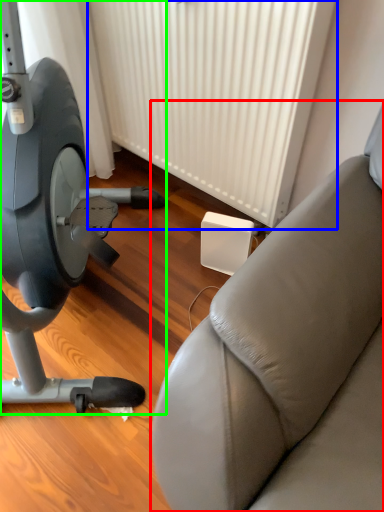
Question: Estimate the real-world distances between objects in this image. Which object is closer to studio couch (highlighted by a red box), radiator (highlighted by a blue box) or stationary bicycle (highlighted by a green box)?

Choices:
 (A) radiator
 (B) stationary bicycle

Answer: (B)